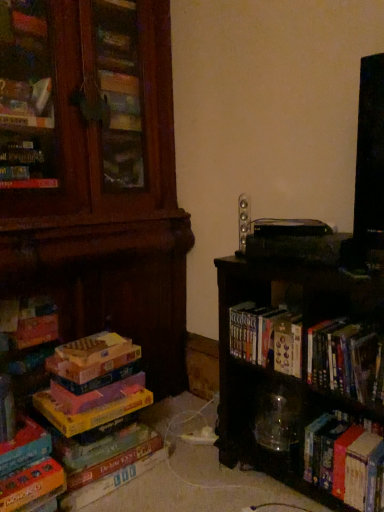
What is the approximate width of hardcover book at right, which is the 2th book from right to left?

hardcover book at right, which is the 2th book from right to left, is 24.93 centimeters wide.

What do you see at coordinates (345, 462) in the screenshot?
I see `hardcover book at lower right, positioned as the 1th book in right-to-left order` at bounding box center [345, 462].

Measure the distance between hardcover books at center, marked as the 3th book in a left-to-right arrangement, and camera.

A distance of 1.46 meters exists between hardcover books at center, marked as the 3th book in a left-to-right arrangement, and camera.

Locate an element on the screen. hardcover book at right, which is the 2th book from right to left is located at coordinates (346, 360).

Is satin silver speaker at upper center not within hardcover book at lower right, positioned as the 1th book in right-to-left order?

Yes.

From a real-world perspective, is satin silver speaker at upper center on top of hardcover book at lower right, the 5th book when ordered from left to right?

Correct, in the physical world, satin silver speaker at upper center is higher than hardcover book at lower right, the 5th book when ordered from left to right.

In the image, is satin silver speaker at upper center positioned in front of or behind hardcover book at lower right, the 5th book when ordered from left to right?

In the image, satin silver speaker at upper center appears behind hardcover book at lower right, the 5th book when ordered from left to right.

Could you tell me if satin silver speaker at upper center is turned towards hardcover book at lower right, the 5th book when ordered from left to right?

No, satin silver speaker at upper center does not turn towards hardcover book at lower right, the 5th book when ordered from left to right.

Considering the relative sizes of multicolored cardboard at left, the fourth book from the right, and hardcover books at center, marked as the 3th book in a left-to-right arrangement, in the image provided, is multicolored cardboard at left, the fourth book from the right, wider than hardcover books at center, marked as the 3th book in a left-to-right arrangement,?

Yes.

From the image's perspective, is multicolored cardboard at left, the fourth book from the right, above hardcover books at center, arranged as the third book when viewed from the right?

Incorrect, from the image's perspective, multicolored cardboard at left, the fourth book from the right, is lower than hardcover books at center, arranged as the third book when viewed from the right.

Does multicolored cardboard at left, the fourth book from the right, lie behind hardcover books at center, arranged as the third book when viewed from the right?

That is True.

Can you confirm if orange cardboard monopoly game at lower left, the fifth book from the right, is taller than black matte bookshelf at right?

No.

From a real-world perspective, who is located lower, orange cardboard monopoly game at lower left, the fifth book from the right, or black matte bookshelf at right?

orange cardboard monopoly game at lower left, the fifth book from the right, is physically lower.

Does point (9, 506) appear closer or farther from the camera than point (295, 469)?

Point (9, 506).

From the image's perspective, is orange cardboard monopoly game at lower left, which appears as the first book when viewed from the left, below black matte bookshelf at right?

Correct, orange cardboard monopoly game at lower left, which appears as the first book when viewed from the left, appears lower than black matte bookshelf at right in the image.

From a real-world perspective, count 1st books downward from the hardcover book at right, which is the 2th book from right to left, and point to it. Please provide its 2D coordinates.

[(267, 337)]

Based on the photo, who is shorter, hardcover books at center, marked as the 3th book in a left-to-right arrangement, or hardcover book at right, placed as the 4th book when sorted from left to right?

With less height is hardcover books at center, marked as the 3th book in a left-to-right arrangement.

From the image's perspective, is hardcover books at center, arranged as the third book when viewed from the right, beneath hardcover book at right, which is the 2th book from right to left?

No, from the image's perspective, hardcover books at center, arranged as the third book when viewed from the right, is not beneath hardcover book at right, which is the 2th book from right to left.

Can we say multicolored cardboard at left, arranged as the 2th book when viewed from the left, lies outside orange cardboard monopoly game at lower left, which appears as the first book when viewed from the left?

That's correct, multicolored cardboard at left, arranged as the 2th book when viewed from the left, is outside of orange cardboard monopoly game at lower left, which appears as the first book when viewed from the left.

In the scene shown: Can you see multicolored cardboard at left, arranged as the 2th book when viewed from the left, touching orange cardboard monopoly game at lower left, the fifth book from the right?

No, multicolored cardboard at left, arranged as the 2th book when viewed from the left, is not in contact with orange cardboard monopoly game at lower left, the fifth book from the right.

From the image's perspective, is multicolored cardboard at left, the fourth book from the right, over orange cardboard monopoly game at lower left, which appears as the first book when viewed from the left?

Yes, from the image's perspective, multicolored cardboard at left, the fourth book from the right, is over orange cardboard monopoly game at lower left, which appears as the first book when viewed from the left.

Is multicolored cardboard at left, arranged as the 2th book when viewed from the left, turned away from orange cardboard monopoly game at lower left, which appears as the first book when viewed from the left?

No.

Between black matte bookshelf at right and hardcover books at center, arranged as the third book when viewed from the right, which one is positioned behind?

hardcover books at center, arranged as the third book when viewed from the right, is further away from the camera.

Is black matte bookshelf at right taller than hardcover books at center, arranged as the third book when viewed from the right?

Indeed, black matte bookshelf at right has a greater height compared to hardcover books at center, arranged as the third book when viewed from the right.

Looking at this image, considering the sizes of black matte bookshelf at right and hardcover books at center, arranged as the third book when viewed from the right, in the image, is black matte bookshelf at right wider or thinner than hardcover books at center, arranged as the third book when viewed from the right,?

In the image, black matte bookshelf at right appears to be wider than hardcover books at center, arranged as the third book when viewed from the right.

Is hardcover books at center, marked as the 3th book in a left-to-right arrangement, not within satin silver speaker at upper center?

Yes, hardcover books at center, marked as the 3th book in a left-to-right arrangement, is located beyond the bounds of satin silver speaker at upper center.

From the picture: Is hardcover books at center, marked as the 3th book in a left-to-right arrangement, beside satin silver speaker at upper center?

No, hardcover books at center, marked as the 3th book in a left-to-right arrangement, is not beside satin silver speaker at upper center.

Is hardcover books at center, marked as the 3th book in a left-to-right arrangement, taller or shorter than satin silver speaker at upper center?

hardcover books at center, marked as the 3th book in a left-to-right arrangement, is shorter than satin silver speaker at upper center.

This screenshot has width=384, height=512. In order to click on the 4th book located beneath the satin silver speaker at upper center (from a real-world perspective) in this screenshot , I will do `click(345, 462)`.

Find the location of a particular element. book that is the 2nd one when counting downward from the hardcover books at center, marked as the 3th book in a left-to-right arrangement (from the image's perspective) is located at coordinates (98, 438).

Based on their spatial positions, is hardcover books at center, arranged as the third book when viewed from the right, or hardcover book at right, which is the 2th book from right to left, closer to multicolored cardboard at left, arranged as the 2th book when viewed from the left?

Among the two, hardcover books at center, arranged as the third book when viewed from the right, is located nearer to multicolored cardboard at left, arranged as the 2th book when viewed from the left.

Considering their positions, is hardcover book at lower right, the 5th book when ordered from left to right, positioned further to orange cardboard monopoly game at lower left, the fifth book from the right, than black matte bookshelf at right?

hardcover book at lower right, the 5th book when ordered from left to right.

From the image, which object appears to be farther from hardcover book at lower right, positioned as the 1th book in right-to-left order, black matte bookshelf at right or hardcover book at right, placed as the 4th book when sorted from left to right?

Based on the image, hardcover book at right, placed as the 4th book when sorted from left to right, appears to be further to hardcover book at lower right, positioned as the 1th book in right-to-left order.

Which object lies further to the anchor point orange cardboard monopoly game at lower left, the fifth book from the right, black matte bookshelf at right or satin silver speaker at upper center?

satin silver speaker at upper center.

Considering their positions, is multicolored cardboard at left, arranged as the 2th book when viewed from the left, positioned closer to orange cardboard monopoly game at lower left, the fifth book from the right, than hardcover book at lower right, the 5th book when ordered from left to right?

multicolored cardboard at left, arranged as the 2th book when viewed from the left, is positioned closer to the anchor orange cardboard monopoly game at lower left, the fifth book from the right.

From the image, which object appears to be nearer to satin silver speaker at upper center, hardcover books at center, marked as the 3th book in a left-to-right arrangement, or black matte bookshelf at right?

hardcover books at center, marked as the 3th book in a left-to-right arrangement, lies closer to satin silver speaker at upper center than the other object.

Estimate the real-world distances between objects in this image. Which object is closer to black matte bookshelf at right, hardcover books at center, arranged as the third book when viewed from the right, or hardcover book at right, placed as the 4th book when sorted from left to right?

hardcover books at center, arranged as the third book when viewed from the right, lies closer to black matte bookshelf at right than the other object.

From the image, which object appears to be farther from black matte bookshelf at right, hardcover book at right, placed as the 4th book when sorted from left to right, or multicolored cardboard at left, arranged as the 2th book when viewed from the left?

multicolored cardboard at left, arranged as the 2th book when viewed from the left, is positioned further to the anchor black matte bookshelf at right.

The width and height of the screenshot is (384, 512). I want to click on speaker between orange cardboard monopoly game at lower left, the fifth book from the right, and black matte bookshelf at right, so click(244, 220).

The height and width of the screenshot is (512, 384). I want to click on shelf between multicolored cardboard at left, arranged as the 2th book when viewed from the left, and hardcover book at lower right, the 5th book when ordered from left to right, in the horizontal direction, so click(303, 378).

Find the location of `book between multicolored cardboard at left, the fourth book from the right, and black matte bookshelf at right`. book between multicolored cardboard at left, the fourth book from the right, and black matte bookshelf at right is located at coordinates (267, 337).

The image size is (384, 512). What are the coordinates of `book between satin silver speaker at upper center and hardcover book at right, which is the 2th book from right to left, in the up-down direction` in the screenshot? It's located at (267, 337).